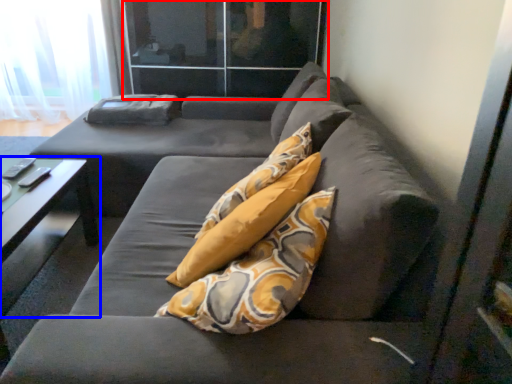
Question: Which object appears farthest to the camera in this image, glass door (highlighted by a red box) or table (highlighted by a blue box)?

Choices:
 (A) glass door
 (B) table

Answer: (A)